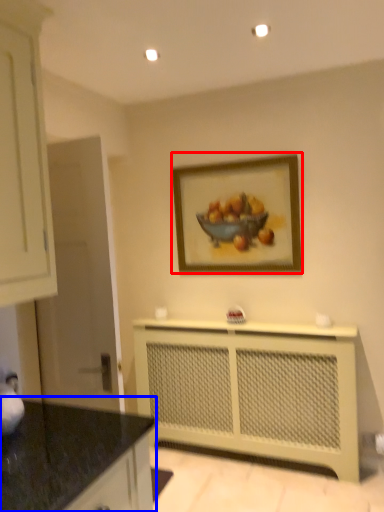
Question: Which of the following is the closest to the observer, picture frame (highlighted by a red box) or countertop (highlighted by a blue box)?

Choices:
 (A) picture frame
 (B) countertop

Answer: (B)